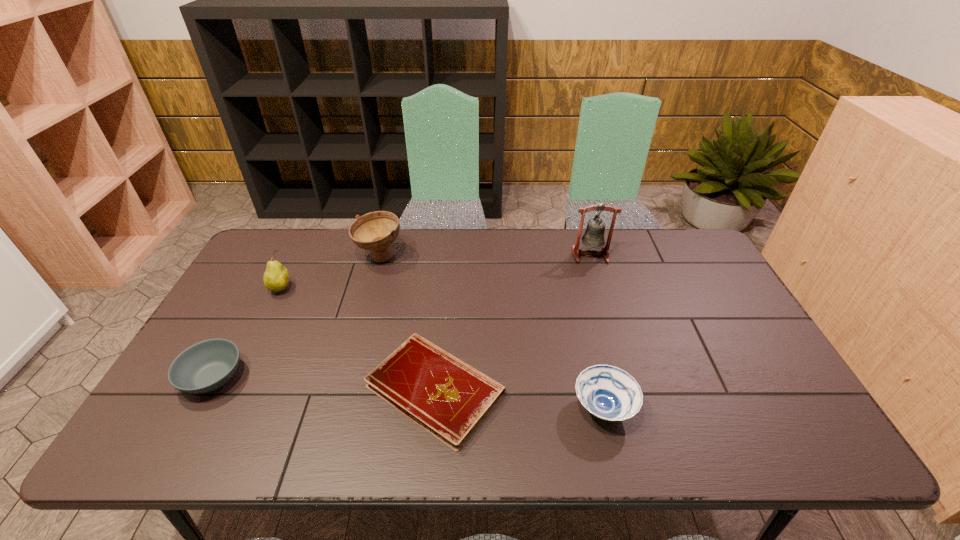
You are a GUI agent. You are given a task and a screenshot of the screen. Output one action in this format:
    pyautogui.click(x=<x>, y=<y>)
    Task: Click on the tallest object
    
    Given the screenshot: What is the action you would take?
    pyautogui.click(x=594, y=235)

Locate an element on the screen. The image size is (960, 540). the tallest soup bowl is located at coordinates [x=376, y=231].

Identify the location of the second soup bowl from left to right. (376, 231).

In order to click on the third farthest object in this screenshot , I will do `click(276, 277)`.

This screenshot has height=540, width=960. In order to click on the fourth shortest object in this screenshot , I will do `click(276, 277)`.

Where is `the rightmost soup bowl`? the rightmost soup bowl is located at coordinates (609, 393).

In order to click on the leftmost soup bowl in this screenshot , I will do `click(206, 366)`.

This screenshot has width=960, height=540. Find the location of `the shortest object`. the shortest object is located at coordinates (448, 398).

This screenshot has height=540, width=960. In order to click on free space located on the right of the tallest object in this screenshot , I will do `click(702, 255)`.

Identify the location of free space located 0.060m on the front of the fifth shortest object. The height and width of the screenshot is (540, 960). (372, 286).